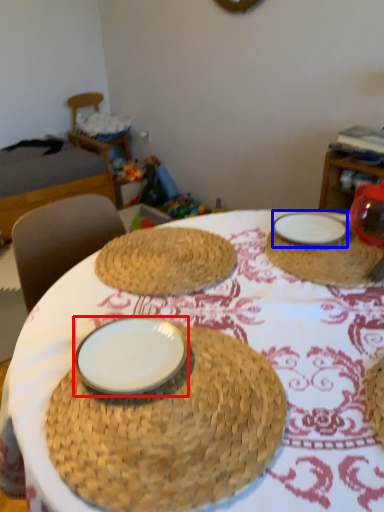
Question: Among these objects, which one is farthest to the camera, plate (highlighted by a red box) or plate (highlighted by a blue box)?

Choices:
 (A) plate
 (B) plate

Answer: (B)